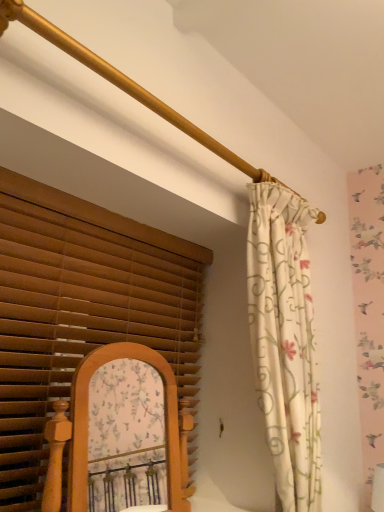
Question: From a real-world perspective, does floral fabric curtain at right sit lower than brown wood blinds at left?

Choices:
 (A) no
 (B) yes

Answer: (A)

Question: Can you confirm if floral fabric curtain at right is shorter than brown wood blinds at left?

Choices:
 (A) yes
 (B) no

Answer: (B)

Question: Can you confirm if floral fabric curtain at right is thinner than brown wood blinds at left?

Choices:
 (A) yes
 (B) no

Answer: (B)

Question: From the image's perspective, does floral fabric curtain at right appear lower than brown wood blinds at left?

Choices:
 (A) yes
 (B) no

Answer: (B)

Question: Would you say floral fabric curtain at right is a long distance from brown wood blinds at left?

Choices:
 (A) yes
 (B) no

Answer: (B)

Question: Is floral fabric curtain at right at the right side of brown wood blinds at left?

Choices:
 (A) yes
 (B) no

Answer: (A)

Question: Does brown wood blinds at left have a larger size compared to floral fabric curtain at right?

Choices:
 (A) no
 (B) yes

Answer: (A)

Question: Could you tell me if brown wood blinds at left is facing floral fabric curtain at right?

Choices:
 (A) no
 (B) yes

Answer: (B)

Question: Does brown wood blinds at left have a lesser height compared to floral fabric curtain at right?

Choices:
 (A) yes
 (B) no

Answer: (A)

Question: From the image's perspective, is brown wood blinds at left beneath floral fabric curtain at right?

Choices:
 (A) no
 (B) yes

Answer: (B)

Question: Does brown wood blinds at left appear on the right side of floral fabric curtain at right?

Choices:
 (A) yes
 (B) no

Answer: (B)

Question: Would you say floral fabric curtain at right is part of brown wood blinds at left's contents?

Choices:
 (A) no
 (B) yes

Answer: (A)

Question: Does point (71, 333) appear closer or farther from the camera than point (288, 506)?

Choices:
 (A) closer
 (B) farther

Answer: (B)